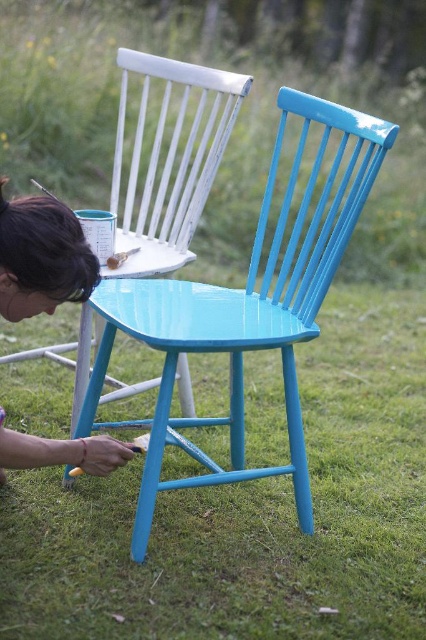
Question: Can you confirm if glossy wood chair at center is positioned below matte blue chair at lower left?

Choices:
 (A) no
 (B) yes

Answer: (B)

Question: Among these objects, which one is farthest from the camera?

Choices:
 (A) matte blue chair at center
 (B) matte blue chair at lower left
 (C) glossy wood chair at center

Answer: (A)

Question: Estimate the real-world distances between objects in this image. Which object is farther from the matte blue chair at lower left?

Choices:
 (A) glossy wood chair at center
 (B) matte blue chair at center

Answer: (B)

Question: Does glossy wood chair at center appear over matte blue chair at lower left?

Choices:
 (A) no
 (B) yes

Answer: (A)

Question: Which point is closer to the camera taking this photo?

Choices:
 (A) (6, 262)
 (B) (314, 164)
 (C) (129, 192)

Answer: (A)

Question: Does glossy wood chair at center appear under matte blue chair at center?

Choices:
 (A) yes
 (B) no

Answer: (A)